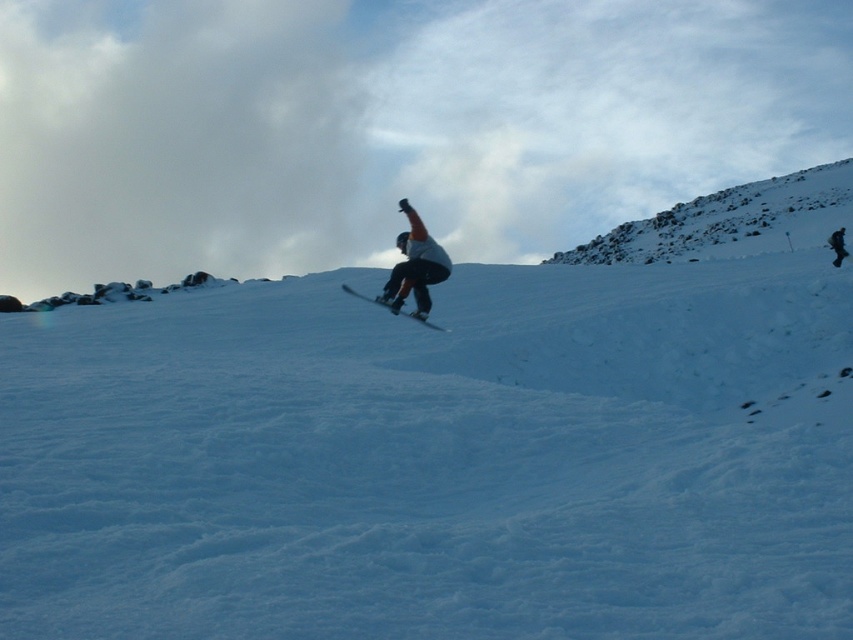
Question: Is white powdery snow at center in front of matte gray snowboarder at center?

Choices:
 (A) yes
 (B) no

Answer: (A)

Question: Which of the following is the closest to the observer?

Choices:
 (A) (418, 292)
 (B) (412, 316)

Answer: (A)

Question: Estimate the real-world distances between objects in this image. Which object is farther from the white powdery snow at center?

Choices:
 (A) matte black snowboard at center
 (B) snowy rocky hill at upper right

Answer: (B)

Question: Based on their relative distances, which object is nearer to the matte black snowboard at center?

Choices:
 (A) matte gray snowboarder at center
 (B) white powdery snow at center

Answer: (A)

Question: Can you confirm if white powdery snow at center is thinner than matte black snowboard at center?

Choices:
 (A) no
 (B) yes

Answer: (A)

Question: Observing the image, what is the correct spatial positioning of snowy rocky hill at upper right in reference to matte black snowboard at center?

Choices:
 (A) below
 (B) above

Answer: (B)